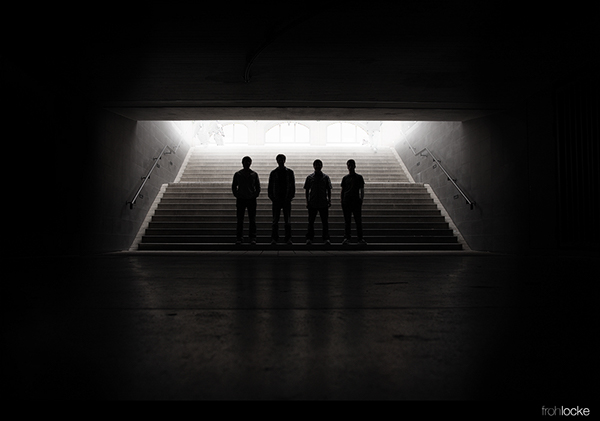
Where is `window`? Image resolution: width=600 pixels, height=421 pixels. window is located at coordinates (275, 135), (290, 132), (302, 133), (331, 132), (342, 132), (360, 132), (240, 136), (234, 134).